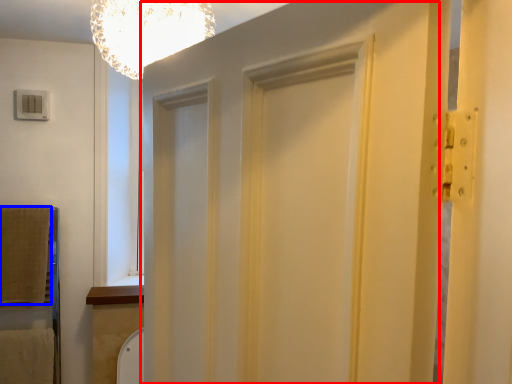
Question: Which object is closer to the camera taking this photo, barn door (highlighted by a red box) or blanket (highlighted by a blue box)?

Choices:
 (A) barn door
 (B) blanket

Answer: (A)